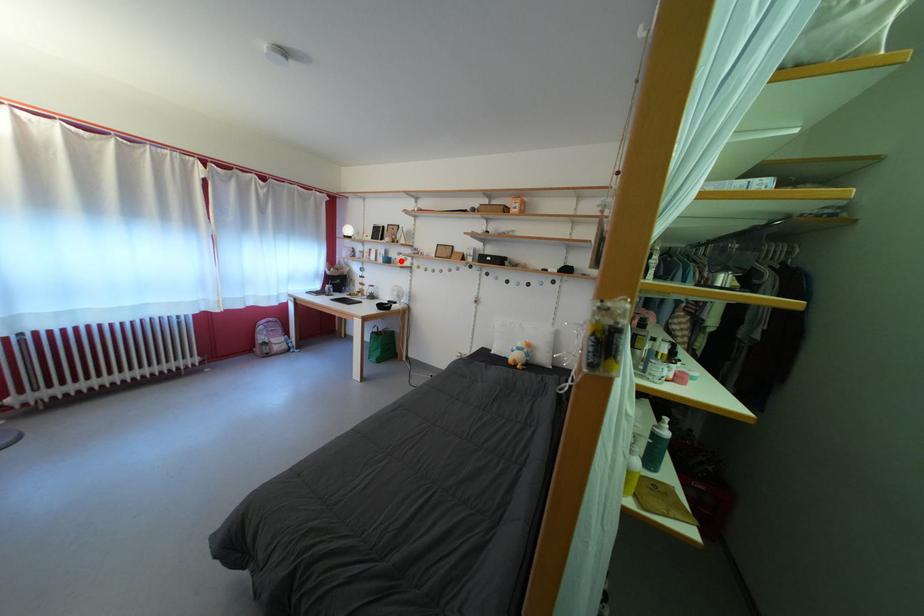
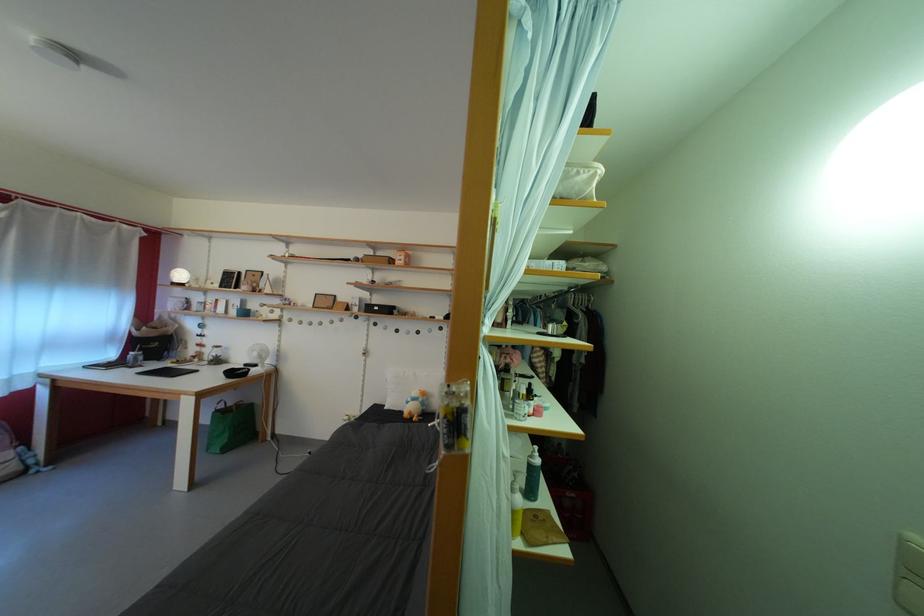
Where in the second image is the point corresponding to the highlighted location from the first image?

(261, 312)